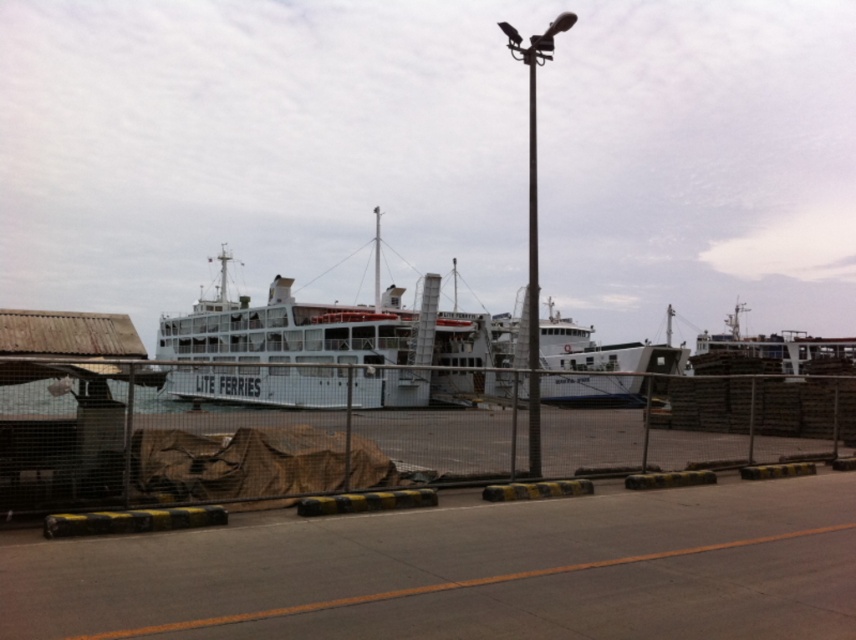
Question: Can you confirm if white matte ferry at center is positioned above metallic pole at center?

Choices:
 (A) yes
 (B) no

Answer: (B)

Question: Does white matte ferry at center come in front of metallic pole at center?

Choices:
 (A) no
 (B) yes

Answer: (B)

Question: Is white matte ferry at center positioned behind polished metal pole at center?

Choices:
 (A) yes
 (B) no

Answer: (B)

Question: Which point is farther to the camera?

Choices:
 (A) (535, 285)
 (B) (513, 38)

Answer: (B)

Question: Which point is closer to the camera?

Choices:
 (A) (366, 340)
 (B) (528, 93)
 (C) (528, 232)

Answer: (A)

Question: Which object is positioned closest to the polished metal pole at center?

Choices:
 (A) white matte ferry at center
 (B) metallic pole at center

Answer: (B)